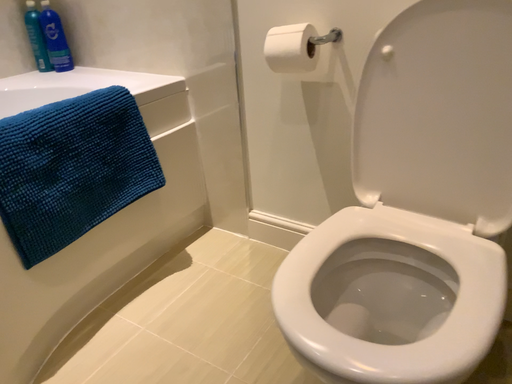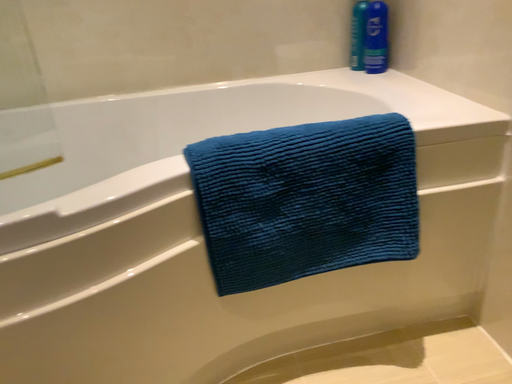
Question: How did the camera likely rotate when shooting the video?

Choices:
 (A) rotated left
 (B) rotated right

Answer: (A)